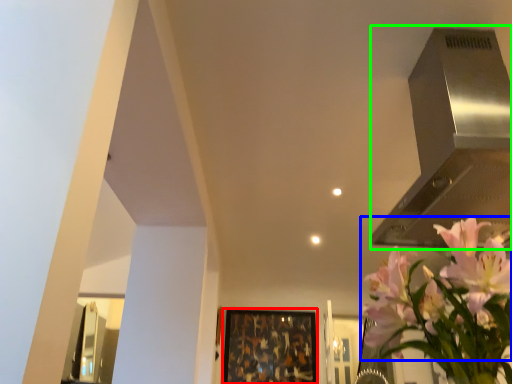
Question: Based on their relative distances, which object is nearer to picture frame (highlighted by a red box)? Choose from flower (highlighted by a blue box) and vent (highlighted by a green box).

Choices:
 (A) flower
 (B) vent

Answer: (B)